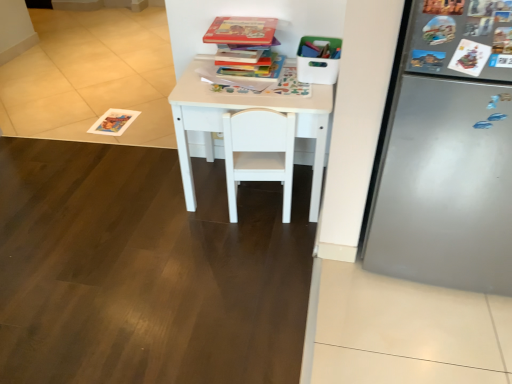
Where is `vacant area that lies in front of white matte chair at center`? Image resolution: width=512 pixels, height=384 pixels. vacant area that lies in front of white matte chair at center is located at coordinates (257, 245).